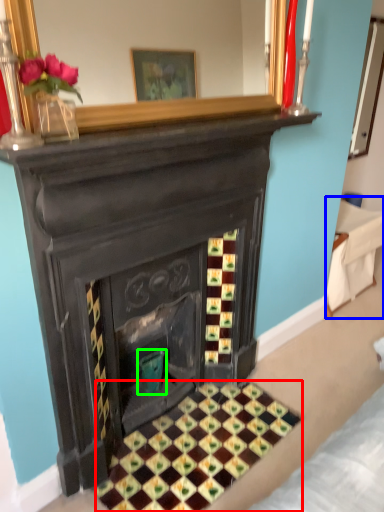
Question: Considering the real-world distances, which object is closest to pattern (highlighted by a red box)? furniture (highlighted by a blue box) or teal (highlighted by a green box).

Choices:
 (A) furniture
 (B) teal

Answer: (B)